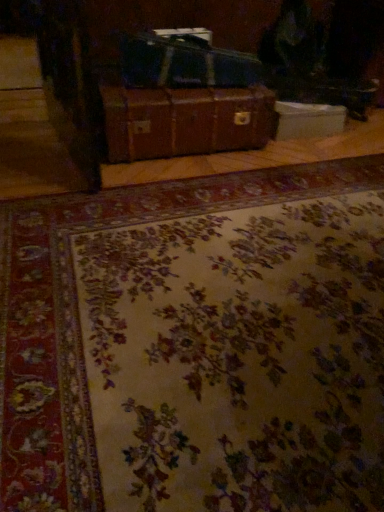
Question: Is white cardboard box at center at the back of floral-patterned carpet at center?

Choices:
 (A) yes
 (B) no

Answer: (B)

Question: Is floral-patterned carpet at center positioned behind white cardboard box at center?

Choices:
 (A) yes
 (B) no

Answer: (B)

Question: Is floral-patterned carpet at center taller than white cardboard box at center?

Choices:
 (A) no
 (B) yes

Answer: (A)

Question: From the image's perspective, does floral-patterned carpet at center appear lower than white cardboard box at center?

Choices:
 (A) yes
 (B) no

Answer: (A)

Question: Can you confirm if floral-patterned carpet at center is bigger than white cardboard box at center?

Choices:
 (A) no
 (B) yes

Answer: (B)

Question: Is floral-patterned carpet at center surrounding white cardboard box at center?

Choices:
 (A) no
 (B) yes

Answer: (A)

Question: Is brown leather suitcase at center at the right side of white cardboard box at center?

Choices:
 (A) yes
 (B) no

Answer: (B)

Question: Is brown leather suitcase at center behind white cardboard box at center?

Choices:
 (A) no
 (B) yes

Answer: (A)

Question: Is brown leather suitcase at center positioned before white cardboard box at center?

Choices:
 (A) yes
 (B) no

Answer: (A)

Question: Is brown leather suitcase at center wider than white cardboard box at center?

Choices:
 (A) yes
 (B) no

Answer: (A)

Question: Is white cardboard box at center located within brown leather suitcase at center?

Choices:
 (A) no
 (B) yes

Answer: (A)

Question: Does brown leather suitcase at center have a lesser width compared to white cardboard box at center?

Choices:
 (A) yes
 (B) no

Answer: (B)

Question: Does white cardboard box at center have a greater width compared to brown leather suitcase at center?

Choices:
 (A) yes
 (B) no

Answer: (B)